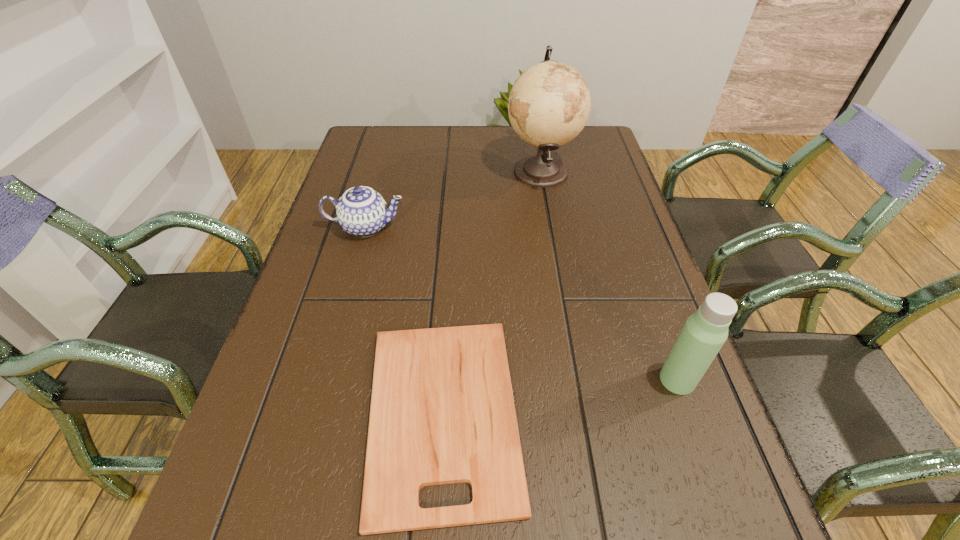
The width and height of the screenshot is (960, 540). Identify the location of free space located 0.050m on the left of the second tallest object. (634, 380).

Identify the location of vacant space located from the spout of the second farthest object. (492, 227).

Where is `vacant region located on the left of the shortest object`? vacant region located on the left of the shortest object is located at coordinates (290, 414).

Image resolution: width=960 pixels, height=540 pixels. In order to click on object present at the far edge in this screenshot , I will do `click(549, 104)`.

At what (x,y) coordinates should I click in order to perform the action: click on object that is positioned at the left edge. Please return your answer as a coordinate pair (x, y). Looking at the image, I should click on (361, 211).

Identify the location of globe situated at the right edge. (549, 104).

This screenshot has width=960, height=540. Identify the location of thermos bottle located at the right edge. (704, 333).

Where is `object that is at the far right corner`? The image size is (960, 540). object that is at the far right corner is located at coordinates (549, 104).

The image size is (960, 540). In the image, there is a desktop. What are the coordinates of `vacant space at the far edge` in the screenshot? It's located at (436, 147).

Where is `vacant space at the left edge of the desktop`? The width and height of the screenshot is (960, 540). vacant space at the left edge of the desktop is located at coordinates (281, 501).